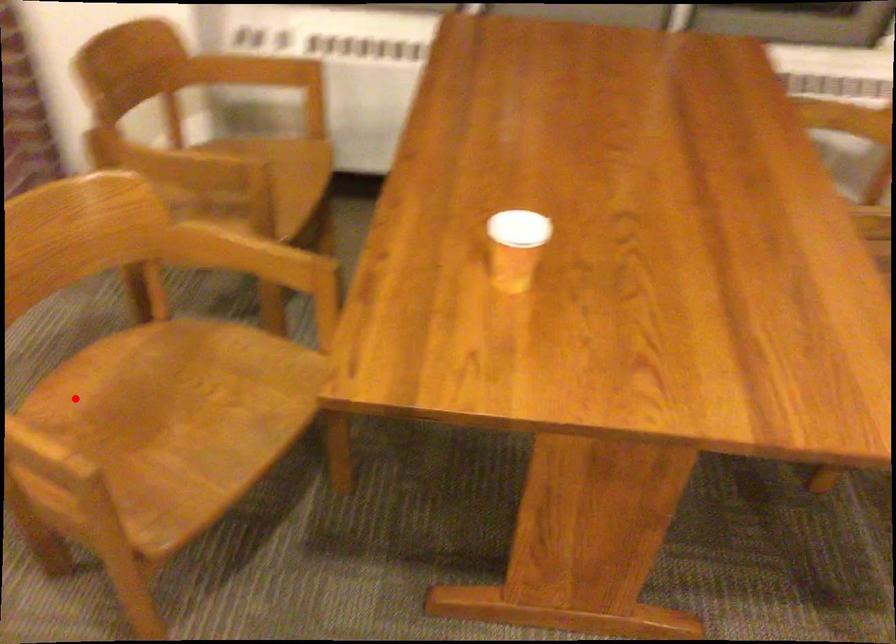
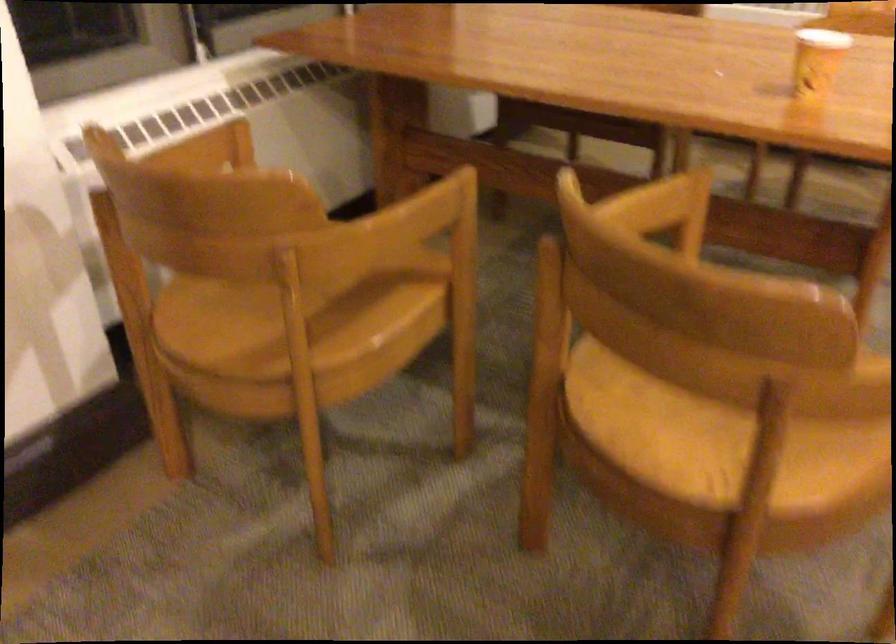
Locate, in the second image, the point that corresponds to the highlighted location in the first image.

(704, 433)